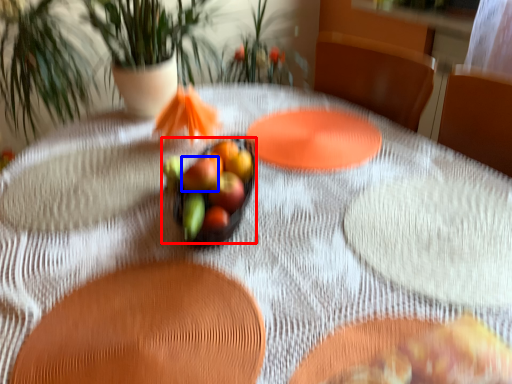
Question: Which object appears closest to the camera in this image, grapefruit (highlighted by a red box) or flower (highlighted by a blue box)?

Choices:
 (A) grapefruit
 (B) flower

Answer: (A)